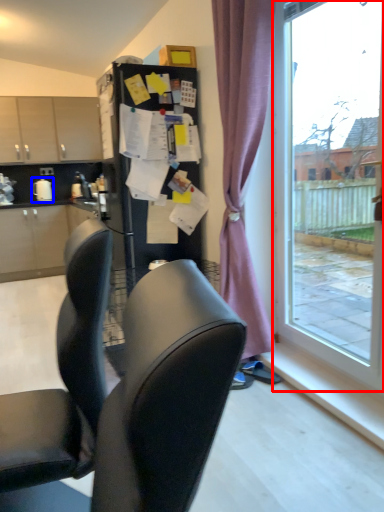
Question: Which object is closer to the camera taking this photo, window (highlighted by a red box) or appliance (highlighted by a blue box)?

Choices:
 (A) window
 (B) appliance

Answer: (A)